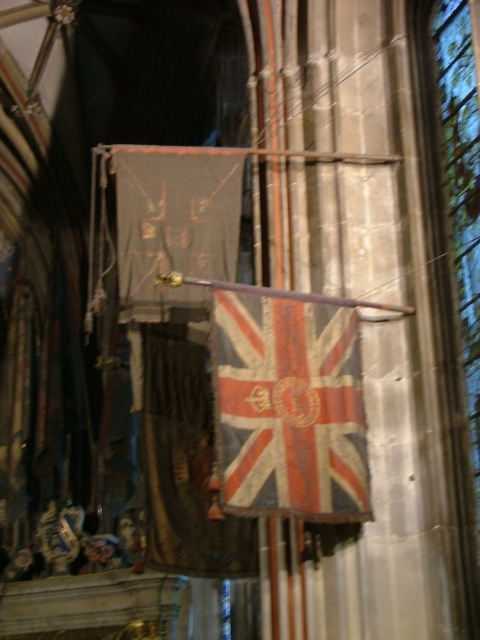
Question: Which object appears closest to the camera in this image?

Choices:
 (A) transparent stained glass at right
 (B) worn fabric flag at center

Answer: (B)

Question: Can you confirm if worn fabric flag at center is positioned to the left of transparent stained glass at right?

Choices:
 (A) yes
 (B) no

Answer: (A)

Question: Which point appears closest to the camera in this image?

Choices:
 (A) (356, 483)
 (B) (474, 353)

Answer: (A)

Question: Can you confirm if worn fabric flag at center is smaller than transparent stained glass at right?

Choices:
 (A) yes
 (B) no

Answer: (A)

Question: Can you confirm if worn fabric flag at center is positioned to the left of transparent stained glass at right?

Choices:
 (A) no
 (B) yes

Answer: (B)

Question: Which point appears closest to the camera in this image?

Choices:
 (A) (446, 49)
 (B) (253, 400)

Answer: (B)